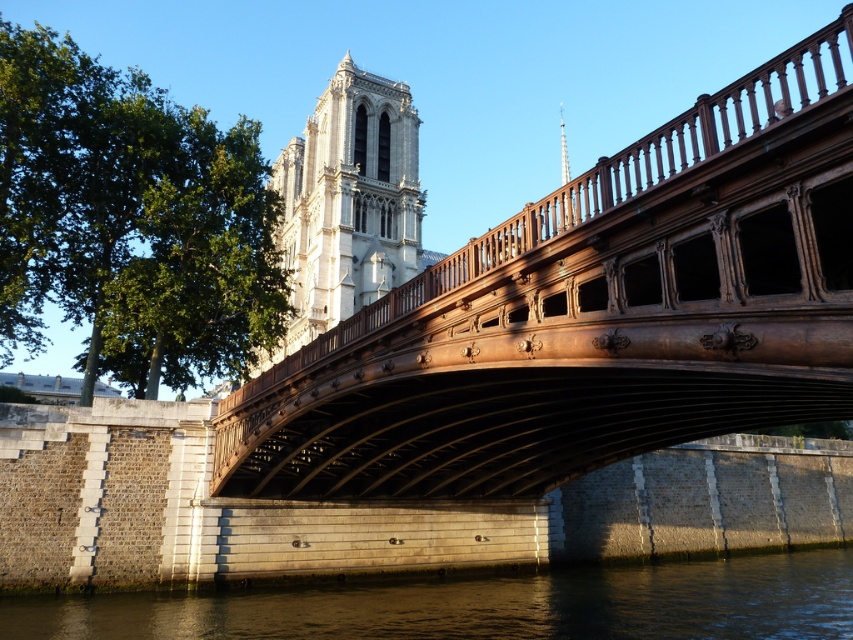
Question: Can you confirm if brown polished wood bridge at center is wider than dark gray water at lower center?

Choices:
 (A) no
 (B) yes

Answer: (A)

Question: Which point appears farthest from the camera in this image?

Choices:
 (A) (312, 192)
 (B) (808, 163)

Answer: (A)

Question: Does brown polished wood bridge at center have a greater width compared to white stone tower at upper center?

Choices:
 (A) no
 (B) yes

Answer: (A)

Question: Which point is closer to the camera?

Choices:
 (A) white stone tower at upper center
 (B) dark gray water at lower center
 (C) brown polished wood bridge at center

Answer: (C)

Question: Is white stone tower at upper center to the right of smooth silver spire at upper center from the viewer's perspective?

Choices:
 (A) yes
 (B) no

Answer: (B)

Question: Among these points, which one is farthest from the camera?

Choices:
 (A) (758, 337)
 (B) (566, 150)
 (C) (39, 620)
 (D) (390, 182)

Answer: (B)